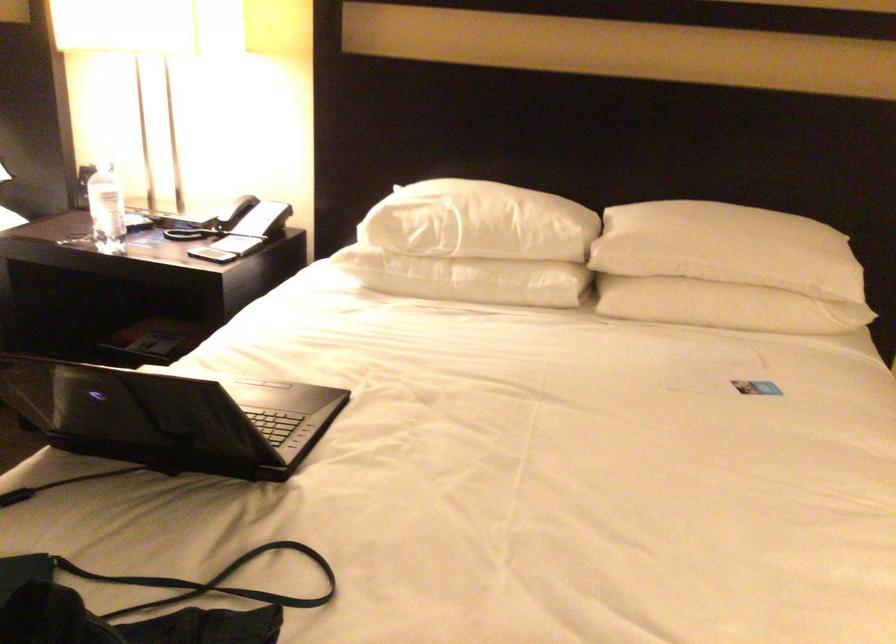
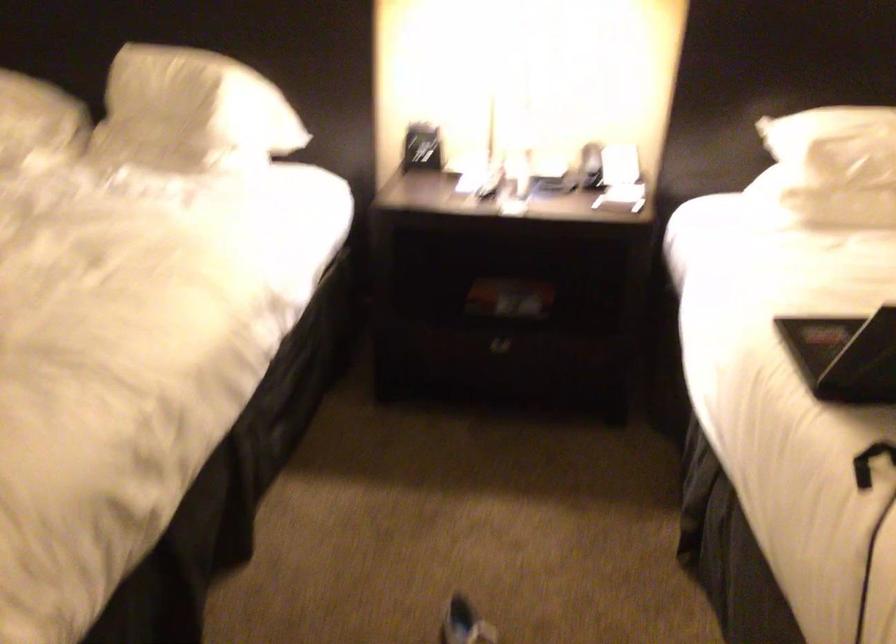
Find the pixel in the second image that matches pixel 248 236 in the first image.

(609, 176)